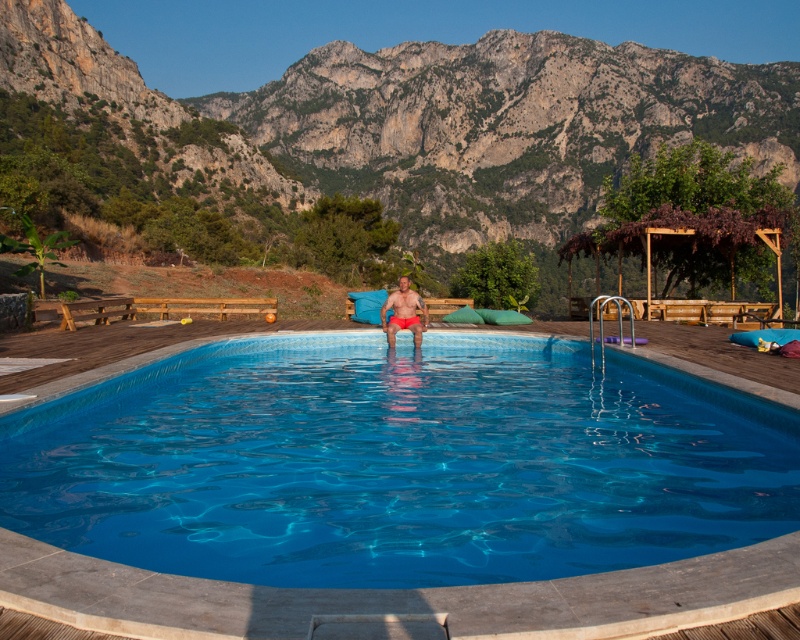
You are planning to place a rectangular table next to the blue glossy pool at center. The table is as wide as the matte red shorts at center. Will the table fit next to the pool without overlapping?

The blue glossy pool at center is wider than the matte red shorts at center. Since the table is as wide as the matte red shorts at center, it will fit next to the pool without overlapping.

You are standing on the wooden deck and want to jump into the blue glossy pool at center. Based on the coordinates provided in the Objects Description, can you determine if the pool is positioned in the center of the deck?

The blue glossy pool at center is located at point (398, 464). Since the coordinates are given as a point, it indicates the center of the pool. Therefore, the pool is indeed positioned in the center of the deck.

You are standing on the wooden deck and want to take a photo of both point (634, 496) and point (566, 220). Which point should you focus on first to ensure both are in the frame?

You should focus on point (634, 496) first because it is closer to you than point (566, 220), allowing both points to be captured in the frame.